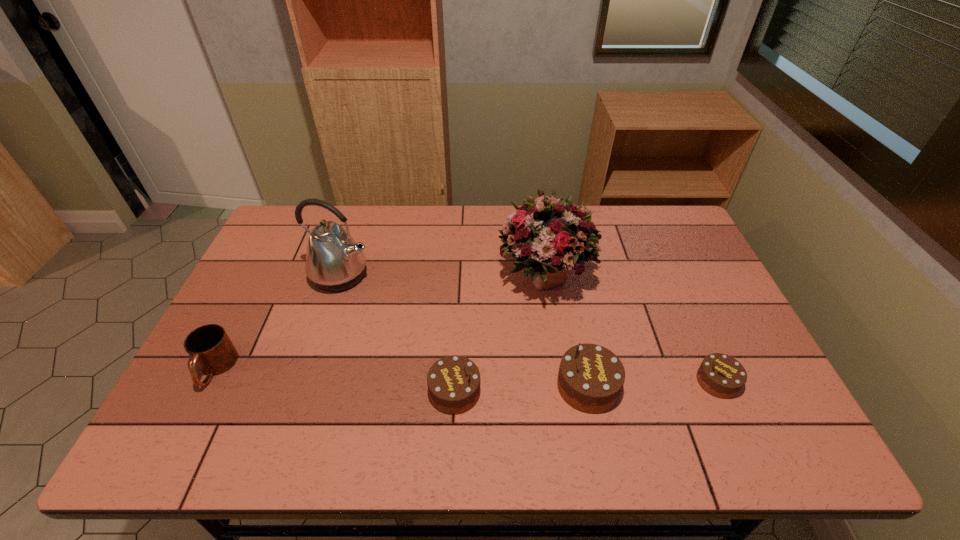
This screenshot has height=540, width=960. In order to click on the fourth object from right to left in this screenshot , I will do `click(453, 382)`.

What are the coordinates of `the leftmost chocolate cake` in the screenshot? It's located at (453, 382).

You are a GUI agent. You are given a task and a screenshot of the screen. Output one action in this format:
    pyautogui.click(x=<x>, y=<y>)
    Task: Click on the fourth shortest object
    
    Given the screenshot: What is the action you would take?
    [590, 379]

Locate an element on the screen. The height and width of the screenshot is (540, 960). the tallest chocolate cake is located at coordinates (590, 379).

What are the coordinates of `the shortest chocolate cake` in the screenshot? It's located at (720, 375).

This screenshot has width=960, height=540. I want to click on the shortest object, so click(x=720, y=375).

You are a GUI agent. You are given a task and a screenshot of the screen. Output one action in this format:
    pyautogui.click(x=<x>, y=<y>)
    Task: Click on the kettle
    
    Given the screenshot: What is the action you would take?
    (334, 261)

What are the coordinates of `bouquet` in the screenshot? It's located at (549, 236).

Image resolution: width=960 pixels, height=540 pixels. Find the location of `the leftmost object`. the leftmost object is located at coordinates (211, 350).

The height and width of the screenshot is (540, 960). Identify the location of vacant space positioned 0.180m on the left of the third object from left to right. (354, 392).